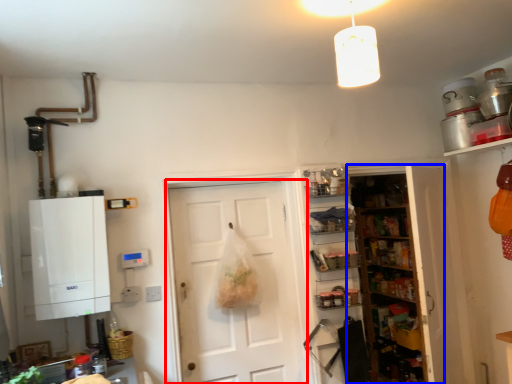
Question: Which object is further to the camera taking this photo, door (highlighted by a red box) or shelf (highlighted by a blue box)?

Choices:
 (A) door
 (B) shelf

Answer: (B)